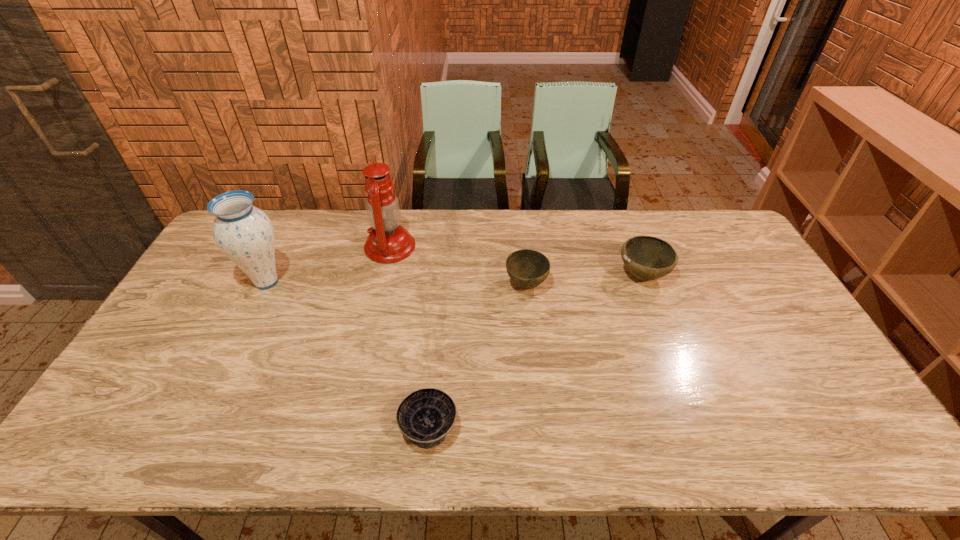
At what (x,y) coordinates should I click in order to perform the action: click on free spot between the second tallest object and the second bowl from left to right. Please return your answer as a coordinate pair (x, y). The image size is (960, 540). Looking at the image, I should click on (396, 284).

Where is `free space between the shortest bowl and the second bowl from left to right`? This screenshot has width=960, height=540. free space between the shortest bowl and the second bowl from left to right is located at coordinates (477, 356).

This screenshot has width=960, height=540. What are the coordinates of `vacant region between the rightmost object and the second object from right to left` in the screenshot? It's located at (584, 280).

I want to click on unoccupied position between the fourth shortest object and the oil lamp, so click(328, 265).

The height and width of the screenshot is (540, 960). What are the coordinates of `free space between the rightmost bowl and the second object from right to left` in the screenshot? It's located at (584, 280).

I want to click on vacant point located between the leftmost object and the second object from right to left, so click(396, 284).

Locate an element on the screen. This screenshot has width=960, height=540. vacant space that's between the second bowl from right to left and the nearest object is located at coordinates (477, 356).

Where is `unoccupied area between the second bowl from left to right and the rightmost object`? The height and width of the screenshot is (540, 960). unoccupied area between the second bowl from left to right and the rightmost object is located at coordinates (584, 280).

The width and height of the screenshot is (960, 540). What are the coordinates of `vacant area that lies between the rightmost bowl and the nearest bowl` in the screenshot? It's located at (536, 352).

Select which object appears as the third closest to the nearest object. Please provide its 2D coordinates. Your answer should be formatted as a tuple, i.e. [(x, y)], where the tuple contains the x and y coordinates of a point satisfying the conditions above.

[(244, 233)]